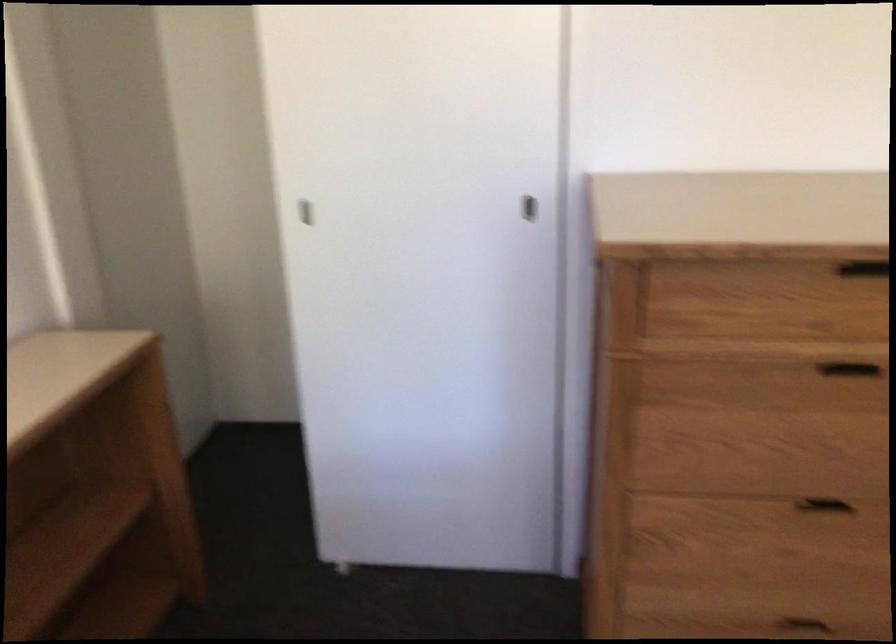
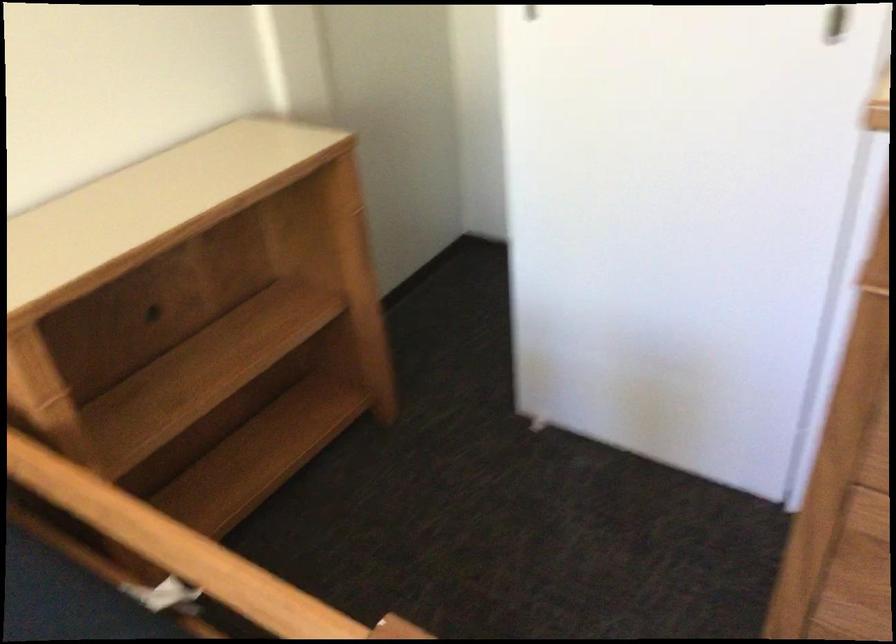
The first image is from the beginning of the video and the second image is from the end. How did the camera likely rotate when shooting the video?

The camera's rotation is toward left-down.